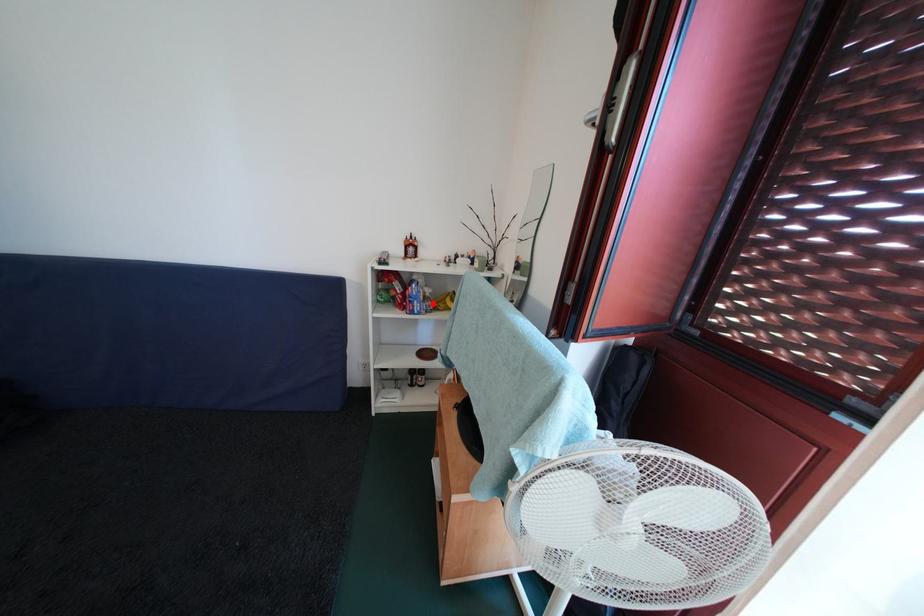
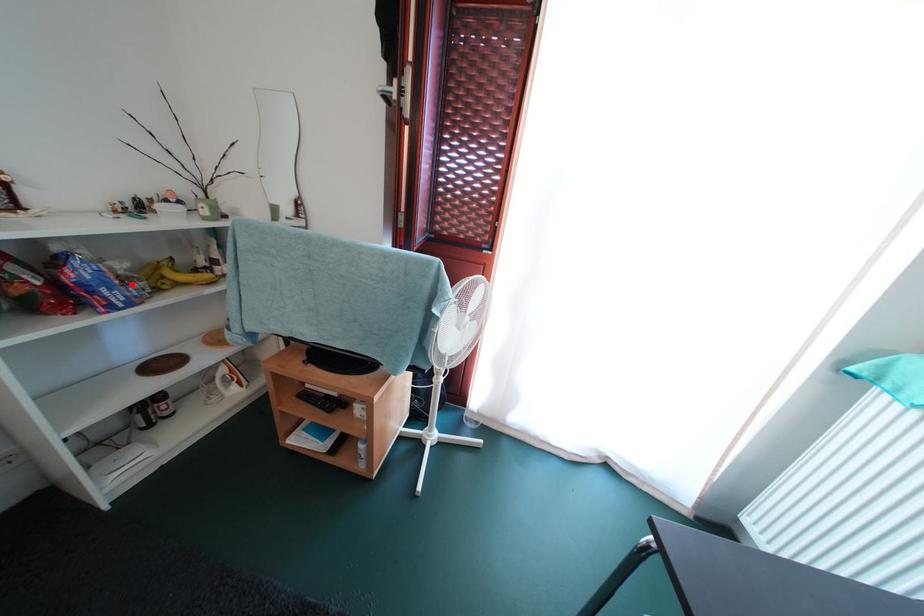
Looking at this image, I am providing you with two images of the same scene from different viewpoints. A red point is marked on the first image and another point is marked on the second image. Is the marked point in image1 the same physical position as the marked point in image2?

Yes